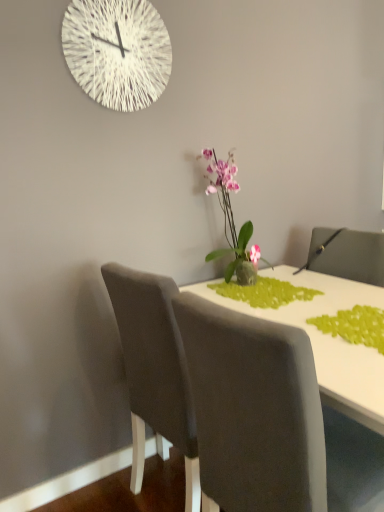
The width and height of the screenshot is (384, 512). I want to click on pink glossy orchid at center, so click(230, 214).

Where is `green textured placemat at lower right, which appears as the first plant when viewed from the front`? green textured placemat at lower right, which appears as the first plant when viewed from the front is located at coordinates (355, 326).

What do you see at coordinates (117, 51) in the screenshot? The image size is (384, 512). I see `white string clock at upper center` at bounding box center [117, 51].

The width and height of the screenshot is (384, 512). What are the coordinates of `white glossy table at center` in the screenshot? It's located at (327, 340).

Where is `pink glossy orchid at center`? This screenshot has height=512, width=384. pink glossy orchid at center is located at coordinates (230, 214).

Is white string clock at upper center in contact with green textured placemat at lower right, the second plant from the back?

white string clock at upper center and green textured placemat at lower right, the second plant from the back, are not in contact.

Would you say white string clock at upper center is inside or outside green textured placemat at lower right, which appears as the first plant when viewed from the front?

white string clock at upper center is not inside green textured placemat at lower right, which appears as the first plant when viewed from the front, it's outside.

Which object is closer to the camera, white string clock at upper center or green textured placemat at lower right, which appears as the first plant when viewed from the front?

green textured placemat at lower right, which appears as the first plant when viewed from the front, is more forward.

Could you tell me if white string clock at upper center is facing green textured placemat at lower right, which appears as the first plant when viewed from the front?

No.

Does white glossy table at center turn towards green textured placemat at lower right, which appears as the first plant when viewed from the front?

Yes.

How different are the orientations of white glossy table at center and green textured placemat at lower right, which appears as the first plant when viewed from the front, in degrees?

The facing directions of white glossy table at center and green textured placemat at lower right, which appears as the first plant when viewed from the front, are 90 degrees apart.

Is white glossy table at center bigger or smaller than green textured placemat at lower right, which appears as the first plant when viewed from the front?

Clearly, white glossy table at center is larger in size than green textured placemat at lower right, which appears as the first plant when viewed from the front.

This screenshot has height=512, width=384. What are the coordinates of `table that appears on the left of green textured placemat at lower right, which appears as the first plant when viewed from the front` in the screenshot? It's located at (327, 340).

Is white string clock at upper center oriented towards white glossy table at center?

No, white string clock at upper center is not facing towards white glossy table at center.

How much distance is there between white string clock at upper center and white glossy table at center?

A distance of 38.98 inches exists between white string clock at upper center and white glossy table at center.

Find the location of a particular element. wall clock above the white glossy table at center (from the image's perspective) is located at coordinates (117, 51).

In the scene shown: Do you think white string clock at upper center is within white glossy table at center, or outside of it?

white string clock at upper center lies outside white glossy table at center.

Locate an element on the screen. wall clock above the green textured placemat at lower right, which appears as the first plant when viewed from the front (from a real-world perspective) is located at coordinates (117, 51).

From the picture: Is green textured placemat at lower right, which appears as the first plant when viewed from the front, shorter than white string clock at upper center?

Correct, green textured placemat at lower right, which appears as the first plant when viewed from the front, is not as tall as white string clock at upper center.

Considering the relative sizes of green textured placemat at lower right, the second plant from the back, and white string clock at upper center in the image provided, is green textured placemat at lower right, the second plant from the back, bigger than white string clock at upper center?

No, green textured placemat at lower right, the second plant from the back, is not bigger than white string clock at upper center.

Relative to white string clock at upper center, is green textured placemat at lower right, which appears as the first plant when viewed from the front, in front or behind?

Visually, green textured placemat at lower right, which appears as the first plant when viewed from the front, is located in front of white string clock at upper center.

Does green matte plant at center, acting as the second plant starting from the front, have a lesser height compared to pink glossy orchid at center?

Yes.

From a real-world perspective, is green matte plant at center, which appears as the 1th plant when viewed from the back, on pink glossy orchid at center?

No.

Is green matte plant at center, which appears as the 1th plant when viewed from the back, behind pink glossy orchid at center?

No, the depth of green matte plant at center, which appears as the 1th plant when viewed from the back, is less than that of pink glossy orchid at center.

Is point (287, 293) positioned in front of point (212, 253)?

Yes, it is in front of point (212, 253).

Is green textured placemat at lower right, which appears as the first plant when viewed from the front, spatially inside green matte plant at center, which appears as the 1th plant when viewed from the back, or outside of it?

green textured placemat at lower right, which appears as the first plant when viewed from the front, is spatially situated outside green matte plant at center, which appears as the 1th plant when viewed from the back.

From the image's perspective, is green textured placemat at lower right, which appears as the first plant when viewed from the front, located beneath green matte plant at center, which appears as the 1th plant when viewed from the back?

Yes, from the image's perspective, green textured placemat at lower right, which appears as the first plant when viewed from the front, is below green matte plant at center, which appears as the 1th plant when viewed from the back.

Between green textured placemat at lower right, which appears as the first plant when viewed from the front, and white glossy table at center, which one has more height?

white glossy table at center.

Is green textured placemat at lower right, the second plant from the back, at the right side of white glossy table at center?

Yes, green textured placemat at lower right, the second plant from the back, is to the right of white glossy table at center.

How different are the orientations of green textured placemat at lower right, which appears as the first plant when viewed from the front, and white glossy table at center in degrees?

The angle between the facing direction of green textured placemat at lower right, which appears as the first plant when viewed from the front, and the facing direction of white glossy table at center is 90 degrees.

Identify the location of wall clock above the green textured placemat at lower right, which appears as the first plant when viewed from the front (from the image's perspective). (117, 51).

Where is `table that appears below the green textured placemat at lower right, the second plant from the back (from a real-world perspective)`? This screenshot has width=384, height=512. table that appears below the green textured placemat at lower right, the second plant from the back (from a real-world perspective) is located at coordinates (327, 340).

Estimate the real-world distances between objects in this image. Which object is further from pink glossy orchid at center, white glossy table at center or white string clock at upper center?

The object further to pink glossy orchid at center is white string clock at upper center.

When comparing their distances from green textured placemat at lower right, which appears as the first plant when viewed from the front, does white glossy table at center or green matte plant at center, acting as the second plant starting from the front, seem closer?

Based on the image, white glossy table at center appears to be nearer to green textured placemat at lower right, which appears as the first plant when viewed from the front.

When comparing their distances from green textured placemat at lower right, the second plant from the back, does green matte plant at center, acting as the second plant starting from the front, or white string clock at upper center seem further?

white string clock at upper center.

Looking at the image, which one is located further to green textured placemat at lower right, which appears as the first plant when viewed from the front, green matte plant at center, which appears as the 1th plant when viewed from the back, or pink glossy orchid at center?

Among the two, pink glossy orchid at center is located further to green textured placemat at lower right, which appears as the first plant when viewed from the front.

Which object lies further to the anchor point white glossy table at center, pink glossy orchid at center or white string clock at upper center?

white string clock at upper center lies further to white glossy table at center than the other object.

From the image, which object appears to be nearer to green matte plant at center, acting as the second plant starting from the front, green textured placemat at lower right, the second plant from the back, or pink glossy orchid at center?

pink glossy orchid at center is positioned closer to the anchor green matte plant at center, acting as the second plant starting from the front.

Considering their positions, is white glossy table at center positioned further to pink glossy orchid at center than green matte plant at center, which appears as the 1th plant when viewed from the back?

white glossy table at center is further to pink glossy orchid at center.

Based on their spatial positions, is white glossy table at center or pink glossy orchid at center closer to green matte plant at center, which appears as the 1th plant when viewed from the back?

Based on the image, white glossy table at center appears to be nearer to green matte plant at center, which appears as the 1th plant when viewed from the back.

Identify the location of houseplant between white string clock at upper center and green matte plant at center, which appears as the 1th plant when viewed from the back, from top to bottom. The width and height of the screenshot is (384, 512). (230, 214).

Locate an element on the screen. plant between white string clock at upper center and green textured placemat at lower right, which appears as the first plant when viewed from the front, in the vertical direction is located at coordinates (264, 292).

At what (x,y) coordinates should I click in order to perform the action: click on plant between green textured placemat at lower right, the second plant from the back, and pink glossy orchid at center, along the z-axis. Please return your answer as a coordinate pair (x, y). Looking at the image, I should click on (264, 292).

You are a GUI agent. You are given a task and a screenshot of the screen. Output one action in this format:
    pyautogui.click(x=<x>, y=<y>)
    Task: Click on the houseplant between white string clock at upper center and green textured placemat at lower right, which appears as the first plant when viewed from the front, vertically
    The height and width of the screenshot is (512, 384).
    Given the screenshot: What is the action you would take?
    pyautogui.click(x=230, y=214)